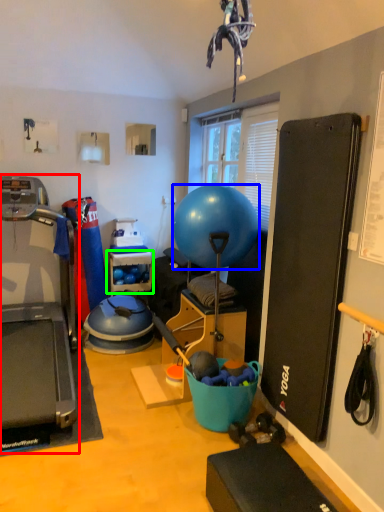
Question: Which object is the closest to the treadmill (highlighted by a red box)? Choose among these: ball (highlighted by a blue box) or shelf (highlighted by a green box).

Choices:
 (A) ball
 (B) shelf

Answer: (B)